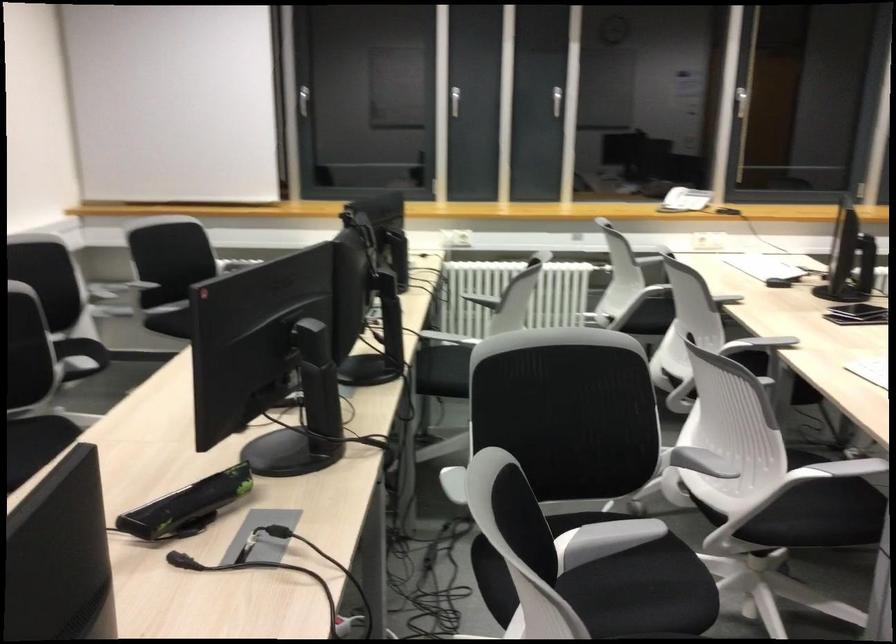
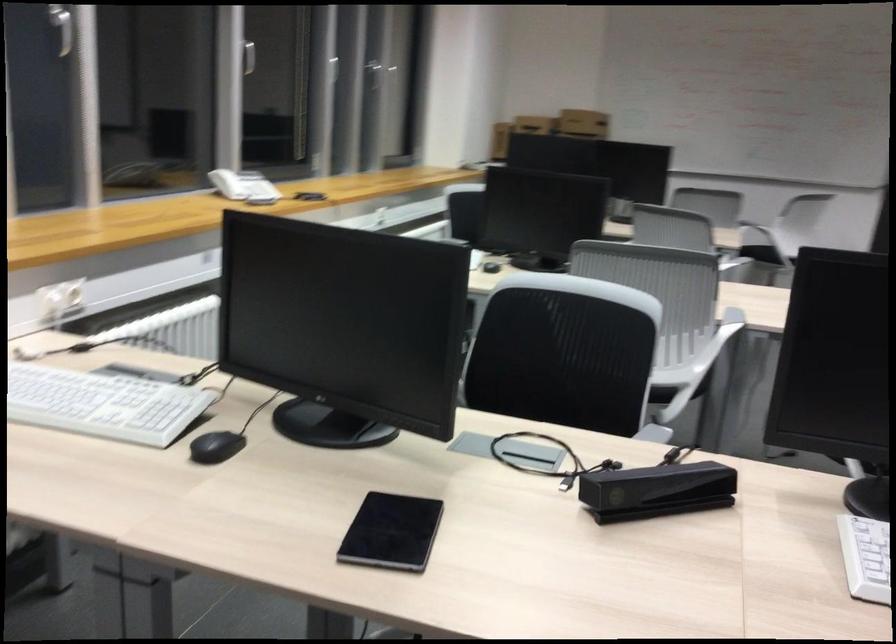
The point at [536,91] is marked in the first image. Where is the corresponding point in the second image?

(62, 26)